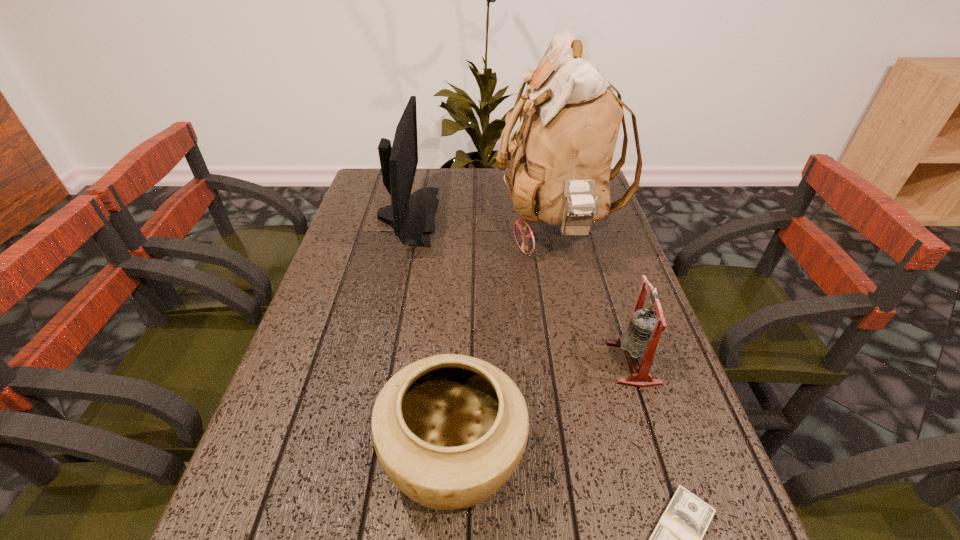
Where is `vacant space at the right edge of the desktop`? The height and width of the screenshot is (540, 960). vacant space at the right edge of the desktop is located at coordinates (616, 257).

This screenshot has height=540, width=960. I want to click on empty space between the pottery and the fourth shortest object, so pyautogui.click(x=431, y=336).

The height and width of the screenshot is (540, 960). I want to click on free space between the third shortest object and the backpack, so click(594, 294).

Find the location of `empty space that is in between the tallest object and the pottery`. empty space that is in between the tallest object and the pottery is located at coordinates (505, 341).

Find the location of a particular element. blank region between the fourth tallest object and the monitor is located at coordinates (431, 336).

Where is `vacant point located between the second tallest object and the backpack`? Image resolution: width=960 pixels, height=540 pixels. vacant point located between the second tallest object and the backpack is located at coordinates click(x=482, y=220).

You are a GUI agent. You are given a task and a screenshot of the screen. Output one action in this format:
    pyautogui.click(x=<x>, y=<y>)
    Task: Click on the free space between the monitor and the second shortest object
    The height and width of the screenshot is (540, 960).
    Given the screenshot: What is the action you would take?
    pyautogui.click(x=431, y=336)

The height and width of the screenshot is (540, 960). Find the location of `unoccupied area between the third tallest object and the fourth tallest object`. unoccupied area between the third tallest object and the fourth tallest object is located at coordinates (543, 410).

The width and height of the screenshot is (960, 540). Find the location of `blank region between the tallest object and the monitor`. blank region between the tallest object and the monitor is located at coordinates (482, 220).

Locate an element on the screen. This screenshot has height=540, width=960. object that is the nearest to the second shortest object is located at coordinates coord(677,539).